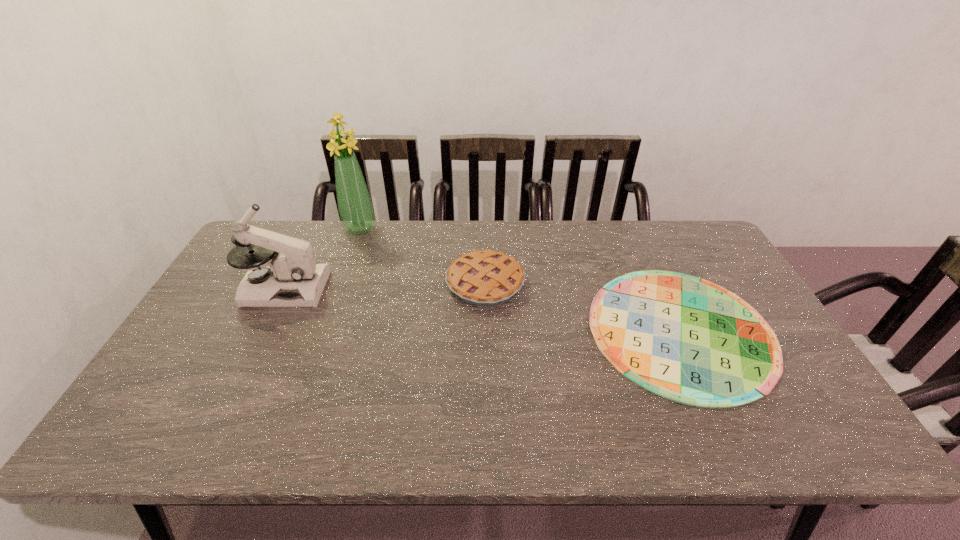
Identify the location of vacant point located 0.280m on the back of the shortest object. This screenshot has height=540, width=960. (631, 221).

This screenshot has width=960, height=540. Find the location of `bouquet located in the far edge section of the desktop`. bouquet located in the far edge section of the desktop is located at coordinates (355, 208).

Find the location of `pie that is at the far edge`. pie that is at the far edge is located at coordinates (486, 278).

This screenshot has width=960, height=540. I want to click on object at the left edge, so click(293, 279).

Identify the location of object that is positioned at the right edge. This screenshot has width=960, height=540. (686, 339).

Where is `vacant region at the far edge of the desktop`? This screenshot has height=540, width=960. vacant region at the far edge of the desktop is located at coordinates (554, 220).

Where is `vacant space at the near edge of the desktop`? vacant space at the near edge of the desktop is located at coordinates (508, 434).

This screenshot has height=540, width=960. Find the location of `free spot at the left edge of the desktop`. free spot at the left edge of the desktop is located at coordinates (225, 352).

This screenshot has width=960, height=540. In the image, there is a desktop. Find the location of `free region at the right edge`. free region at the right edge is located at coordinates (774, 404).

What are the coordinates of `free space between the microscope and the pie` in the screenshot? It's located at (385, 286).